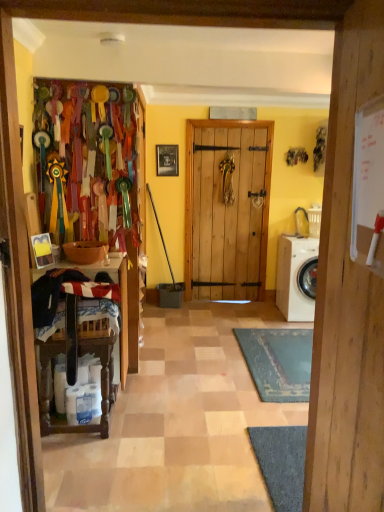
The width and height of the screenshot is (384, 512). What do you see at coordinates (347, 298) in the screenshot?
I see `wooden door at center` at bounding box center [347, 298].

Describe the element at coordinates (167, 160) in the screenshot. This screenshot has width=384, height=512. I see `wooden frame at center` at that location.

I want to click on wooden door at center, so click(347, 298).

You are a GUI agent. You are given a task and a screenshot of the screen. Output one action in this format:
    pyautogui.click(x=<x>, y=<y>)
    Task: Click on the washing machine on the right of wooden frame at center
    The width and height of the screenshot is (384, 512).
    Given the screenshot: What is the action you would take?
    pyautogui.click(x=294, y=277)

Which of these two, wooden frame at center or white matte washing machine at right, is smaller?

wooden frame at center is smaller.

Is wooden frame at center in contact with white matte washing machine at right?

No, wooden frame at center is not with white matte washing machine at right.

Is white matte washing machine at right completely or partially inside wooden frame at center?

That's incorrect, white matte washing machine at right is not inside wooden frame at center.

In the scene shown: Is white matte washing machine at right with wooden door at center?

There is a gap between white matte washing machine at right and wooden door at center.

This screenshot has width=384, height=512. In order to click on washing machine located below the wooden door at center (from the image's perspective) in this screenshot , I will do `click(294, 277)`.

Does white matte washing machine at right have a lesser height compared to wooden door at center?

Indeed, white matte washing machine at right has a lesser height compared to wooden door at center.

From the image's perspective, is white matte washing machine at right on wooden door at center?

No, from the image's perspective, white matte washing machine at right is not over wooden door at center.

In the scene shown: From the image's perspective, is wooden frame at center above wooden door at center?

Yes, from the image's perspective, wooden frame at center is over wooden door at center.

Which is nearer, (167, 175) or (357, 457)?

Clearly, point (167, 175) is more distant from the camera than point (357, 457).

Where is `door to the right of wooden frame at center`? door to the right of wooden frame at center is located at coordinates (347, 298).

Looking at this image, is wooden frame at center wider or thinner than wooden door at center?

Clearly, wooden frame at center has less width compared to wooden door at center.

Is white matte washing machine at right looking in the opposite direction of wooden frame at center?

No, wooden frame at center is not at the back of white matte washing machine at right.

Find the location of a particular element. The width and height of the screenshot is (384, 512). picture frame positioned vertically above the white matte washing machine at right (from a real-world perspective) is located at coordinates (167, 160).

Which is behind, point (306, 319) or point (164, 150)?

The point (164, 150) is behind.

Is wooden door at center next to wooden frame at center and touching it?

wooden door at center is not next to wooden frame at center, and they're not touching.

From a real-world perspective, who is located lower, wooden door at center or wooden frame at center?

From a 3D spatial view, wooden door at center is below.

Is wooden door at center closer to camera compared to wooden frame at center?

Yes, wooden door at center is closer to the viewer.

Does wooden door at center have a greater width compared to white matte washing machine at right?

Incorrect, the width of wooden door at center does not surpass that of white matte washing machine at right.

Is wooden door at center turned away from white matte washing machine at right?

No, white matte washing machine at right is not at the back of wooden door at center.

Looking at this image, in terms of height, does wooden door at center look taller or shorter compared to white matte washing machine at right?

Considering their sizes, wooden door at center has more height than white matte washing machine at right.

How different are the orientations of wooden door at center and white matte washing machine at right in degrees?

They differ by 96.2 degrees in their facing directions.

At what (x,y) coordinates should I click in order to perform the action: click on washing machine directly beneath the wooden frame at center (from a real-world perspective). Please return your answer as a coordinate pair (x, y). Looking at the image, I should click on (294, 277).

Locate an element on the screen. Image resolution: width=384 pixels, height=512 pixels. door that appears above the white matte washing machine at right (from the image's perspective) is located at coordinates (347, 298).

When comparing their distances from wooden door at center, does wooden frame at center or white matte washing machine at right seem further?

wooden frame at center.

From the image, which object appears to be nearer to wooden frame at center, wooden door at center or white matte washing machine at right?

Among the two, white matte washing machine at right is located nearer to wooden frame at center.

Considering their positions, is white matte washing machine at right positioned closer to wooden door at center than wooden frame at center?

white matte washing machine at right is positioned closer to the anchor wooden door at center.

Consider the image. Considering their positions, is wooden door at center positioned closer to white matte washing machine at right than wooden frame at center?

Among the two, wooden frame at center is located nearer to white matte washing machine at right.

Looking at this image, considering their positions, is wooden frame at center positioned closer to white matte washing machine at right than wooden door at center?

wooden frame at center is closer to white matte washing machine at right.

Based on their spatial positions, is white matte washing machine at right or wooden door at center further from wooden frame at center?

The object further to wooden frame at center is wooden door at center.

Find the location of a particular element. This screenshot has height=512, width=384. washing machine positioned between wooden door at center and wooden frame at center from near to far is located at coordinates [x=294, y=277].